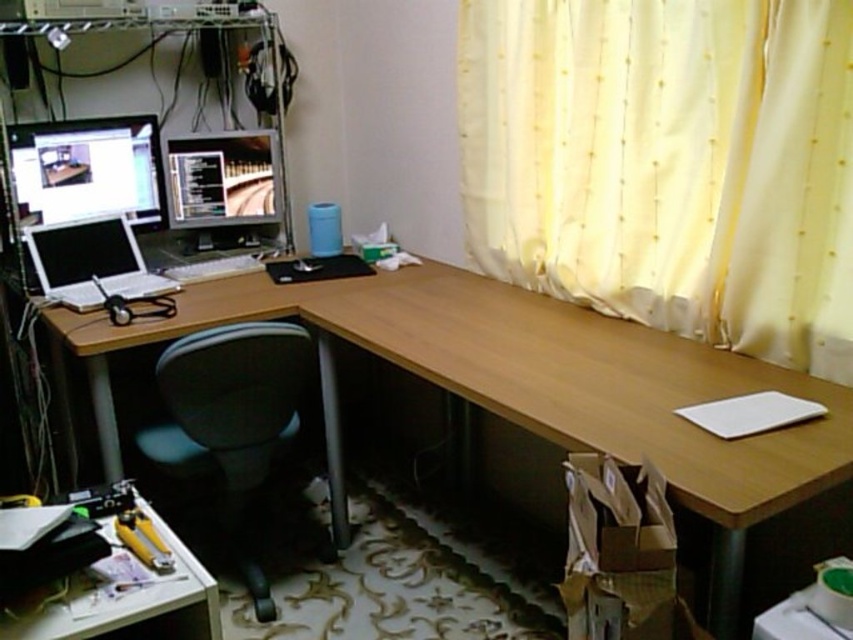
Can you confirm if light brown wood computer desk at center is positioned below white plastic table at lower left?

Incorrect, light brown wood computer desk at center is not positioned below white plastic table at lower left.

Based on the photo, can you confirm if light brown wood computer desk at center is positioned to the right of white plastic table at lower left?

Correct, you'll find light brown wood computer desk at center to the right of white plastic table at lower left.

What do you see at coordinates (520, 387) in the screenshot? The image size is (853, 640). I see `light brown wood computer desk at center` at bounding box center [520, 387].

Find the location of `light brown wood computer desk at center`. light brown wood computer desk at center is located at coordinates (520, 387).

Who is more forward, (160, 464) or (132, 532)?

Point (132, 532)

Which is below, black fabric swivel chair at lower left or yellow plastic tool at lower left?

yellow plastic tool at lower left is below.

Is point (199, 422) farther from viewer compared to point (135, 525)?

Yes, it is.

Locate an element on the screen. The image size is (853, 640). black fabric swivel chair at lower left is located at coordinates (231, 420).

Who is more forward, (804,440) or (165,557)?

Point (165,557) is in front.

In the scene shown: Can you confirm if light brown wood computer desk at center is positioned above yellow plastic tool at lower left?

Indeed, light brown wood computer desk at center is positioned over yellow plastic tool at lower left.

This screenshot has height=640, width=853. I want to click on light brown wood computer desk at center, so click(520, 387).